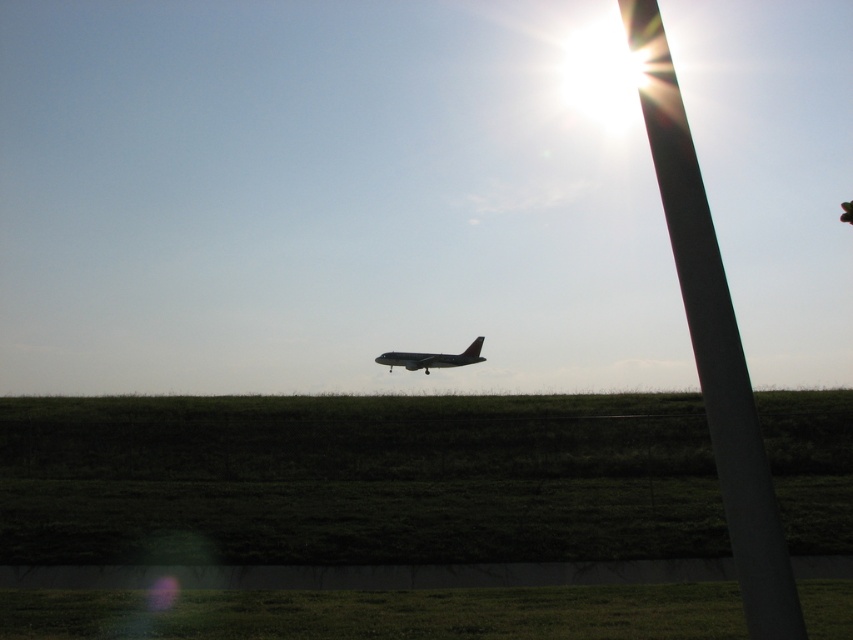
Question: Which of the following is the farthest from the observer?

Choices:
 (A) white smooth pole at upper right
 (B) metallic gray airplane at center

Answer: (B)

Question: Does white smooth pole at upper right appear under metallic gray airplane at center?

Choices:
 (A) no
 (B) yes

Answer: (B)

Question: Is white smooth pole at upper right to the left of metallic gray airplane at center from the viewer's perspective?

Choices:
 (A) no
 (B) yes

Answer: (A)

Question: Does white smooth pole at upper right appear over metallic gray airplane at center?

Choices:
 (A) yes
 (B) no

Answer: (B)